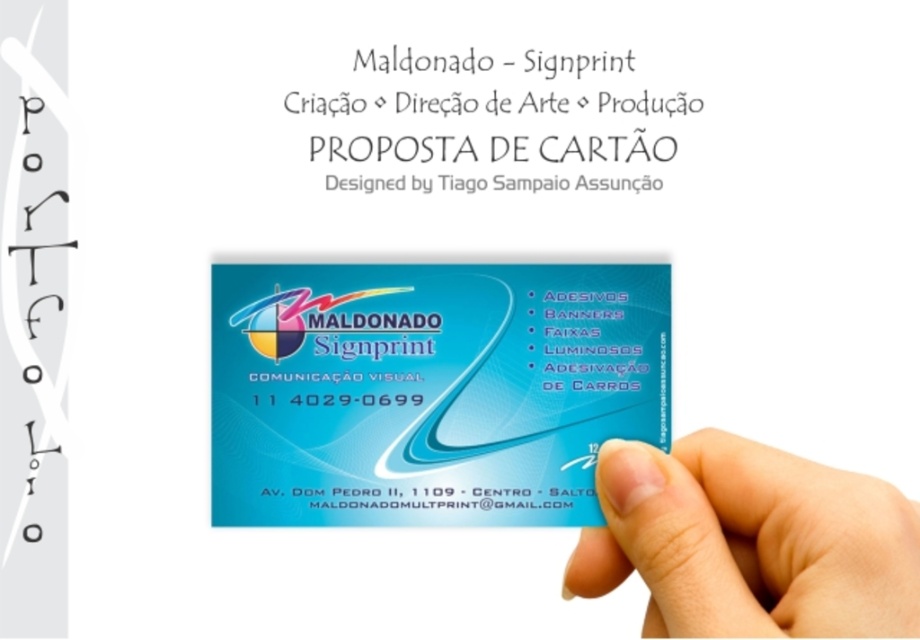
Who is more distant from viewer, (755, 502) or (547, 118)?

Positioned behind is point (547, 118).

Can you confirm if matte blue card at lower right is wider than white paper at upper center?

No.

Between point (581, 596) and point (370, 168), which one is positioned behind?

Positioned behind is point (370, 168).

The image size is (920, 640). In order to click on matte blue card at lower right in this screenshot , I will do `click(749, 541)`.

Can you confirm if blue glossy business card at center is positioned below white paper at upper center?

Indeed, blue glossy business card at center is positioned under white paper at upper center.

Describe the element at coordinates (429, 388) in the screenshot. I see `blue glossy business card at center` at that location.

Identify the location of blue glossy business card at center. (429, 388).

Is point (843, 554) closer to camera compared to point (358, 492)?

That is True.

Is point (792, 582) closer to camera compared to point (355, 496)?

Yes, it is in front of point (355, 496).

What are the coordinates of `matte blue card at lower right` in the screenshot? It's located at (749, 541).